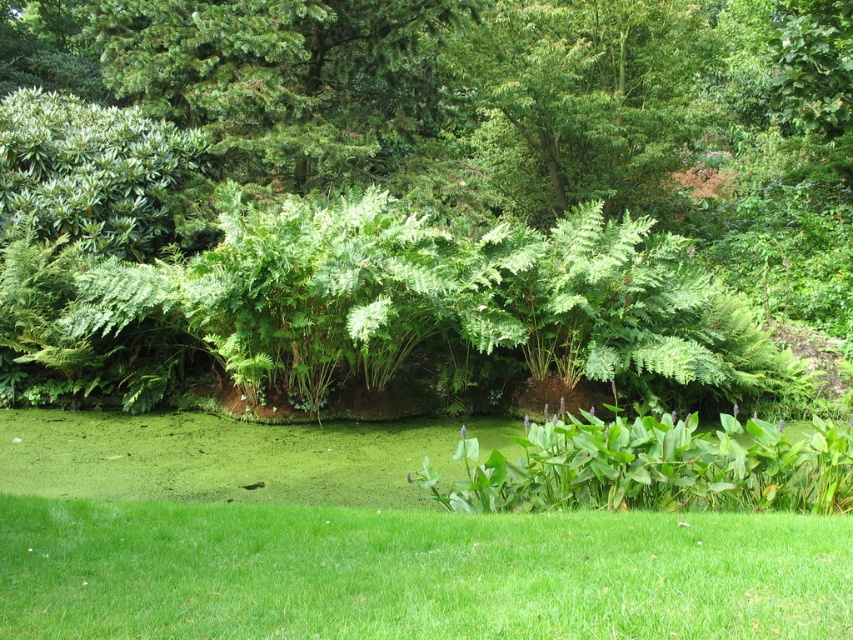
You are standing at the origin point in the scene. Which direction should you move to reach the green grass at lower center?

The green grass at lower center is located at point 0.895 on the x axis and 0.487 on the y axis, so you should move to the right and slightly forward to reach it.